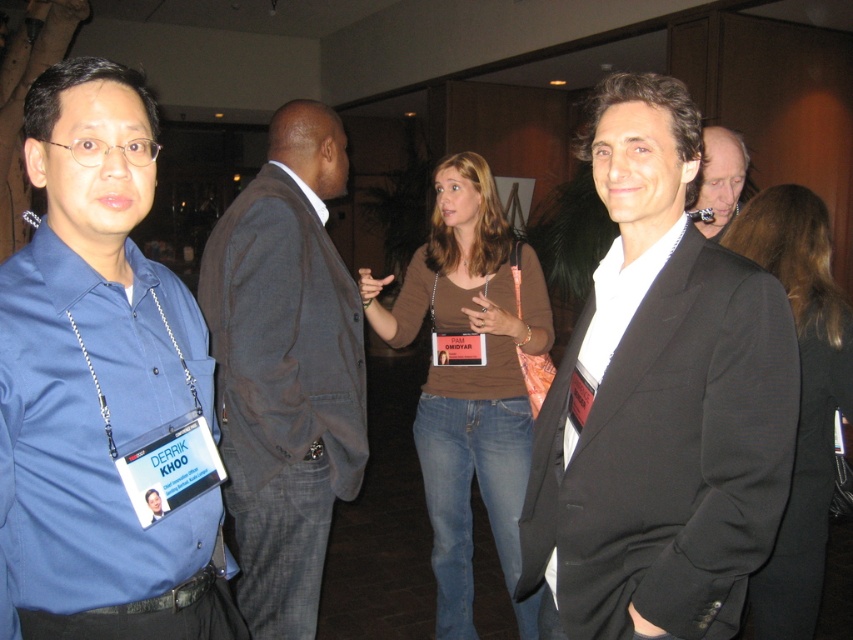
Can you confirm if black satin suit at right is shorter than matte blue shirt at left?

No.

Which of these two, black satin suit at right or matte blue shirt at left, stands shorter?

matte blue shirt at left

Which is in front, point (660, 257) or point (103, 433)?

Point (103, 433) is more forward.

I want to click on black satin suit at right, so pos(659,403).

Does dark brown suit at center have a lesser width compared to smooth gray suit at right?

In fact, dark brown suit at center might be wider than smooth gray suit at right.

Which is more to the left, dark brown suit at center or smooth gray suit at right?

dark brown suit at center is more to the left.

Which is in front, point (289, 403) or point (701, 182)?

Point (289, 403) is in front.

Locate an element on the screen. dark brown suit at center is located at coordinates (285, 369).

Is dark brown suit at center bigger than brown cotton shirt at center?

No, dark brown suit at center is not bigger than brown cotton shirt at center.

Does dark brown suit at center have a lesser width compared to brown cotton shirt at center?

Yes.

Which is behind, point (215, 401) or point (518, 392)?

Positioned behind is point (518, 392).

Where is `dark brown suit at center`? The height and width of the screenshot is (640, 853). dark brown suit at center is located at coordinates (285, 369).